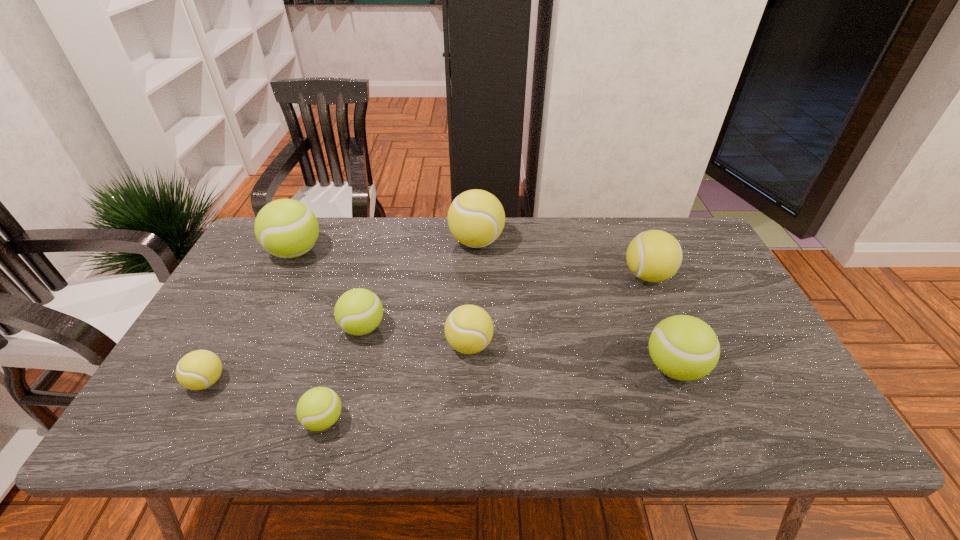
You are a GUI agent. You are given a task and a screenshot of the screen. Output one action in this format:
    pyautogui.click(x=<x>, y=<y>)
    Task: Click on the object at the near edge
    The image size is (960, 540).
    Given the screenshot: What is the action you would take?
    pyautogui.click(x=319, y=408)

At what (x,y) coordinates should I click in order to perform the action: click on object located in the right edge section of the desktop. Please return your answer as a coordinate pair (x, y). The width and height of the screenshot is (960, 540). Looking at the image, I should click on (654, 255).

You are a GUI agent. You are given a task and a screenshot of the screen. Output one action in this format:
    pyautogui.click(x=<x>, y=<y>)
    Task: Click on the object located at the far left corner
    Image resolution: width=960 pixels, height=540 pixels.
    Given the screenshot: What is the action you would take?
    pyautogui.click(x=286, y=228)

This screenshot has height=540, width=960. Find the location of `object positioned at the far right corner`. object positioned at the far right corner is located at coordinates (654, 255).

In the image, there is a desktop. Where is `vacant space at the far edge`? Image resolution: width=960 pixels, height=540 pixels. vacant space at the far edge is located at coordinates (575, 256).

Find the location of a particular element. This screenshot has width=960, height=540. blank space at the near edge of the desktop is located at coordinates (455, 410).

Where is `free space at the left edge of the desktop`? The height and width of the screenshot is (540, 960). free space at the left edge of the desktop is located at coordinates (227, 322).

Identify the location of vacant space at the right edge of the desktop. (758, 335).

Find the location of a particular element. free spot at the far right corner of the desktop is located at coordinates (679, 230).

Locate an element on the screen. vacant space at the near right corner of the desktop is located at coordinates (782, 414).